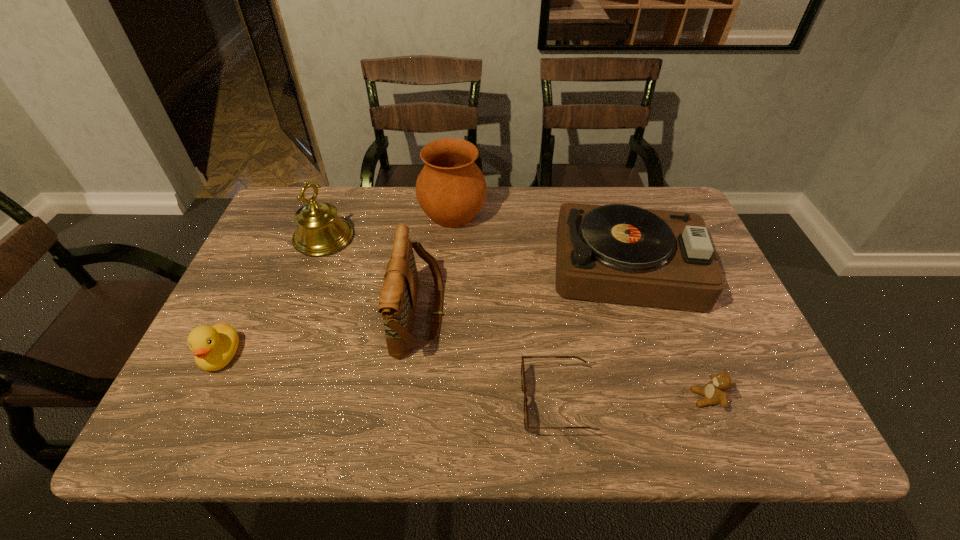
Where is `object present at the near right corner`? object present at the near right corner is located at coordinates (715, 392).

Image resolution: width=960 pixels, height=540 pixels. In the image, there is a desktop. Identify the location of vacant space at the far edge. (517, 194).

Image resolution: width=960 pixels, height=540 pixels. I want to click on vacant space at the near edge of the desktop, so click(x=392, y=409).

Identify the location of free space at the left edge of the desktop. The image size is (960, 540). click(300, 277).

At what (x,y) coordinates should I click in order to perform the action: click on vacant space at the right edge of the desktop. Please return your answer as a coordinate pair (x, y). The image size is (960, 540). Looking at the image, I should click on (722, 323).

Find the location of a particular element. free space at the near left corner of the desktop is located at coordinates (210, 429).

Image resolution: width=960 pixels, height=540 pixels. Find the location of `vacant space at the far right corner of the desktop`. vacant space at the far right corner of the desktop is located at coordinates (631, 192).

The height and width of the screenshot is (540, 960). I want to click on free space between the third shortest object and the sixth object from right to left, so click(273, 297).

Find the location of a particular element. This screenshot has height=540, width=960. free space between the leftmost object and the spectacles is located at coordinates (389, 379).

This screenshot has width=960, height=540. In order to click on vacant region between the pottery and the bell in this screenshot , I will do (x=388, y=226).